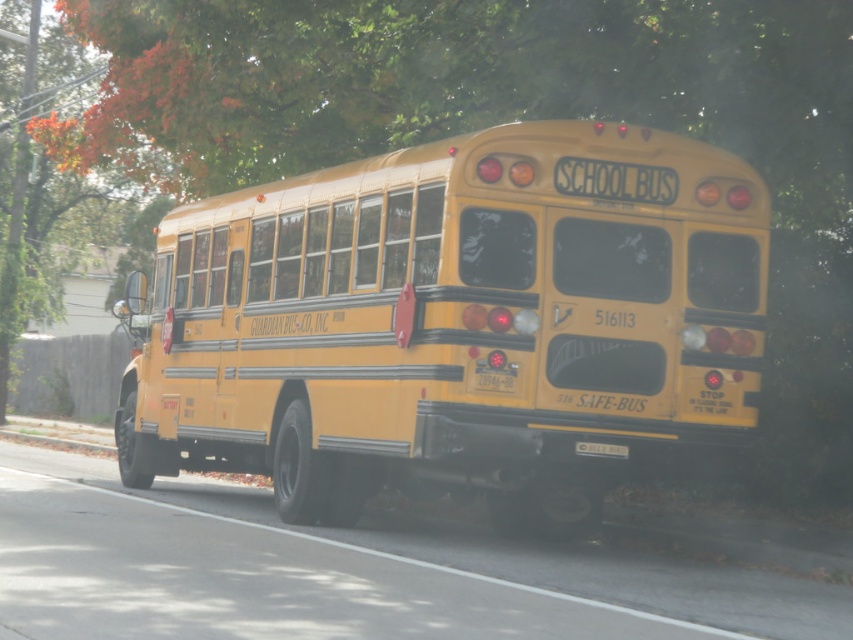
Question: Can you confirm if yellow matte/solid school bus at center is bigger than black plastic license plate at rear?

Choices:
 (A) no
 (B) yes

Answer: (B)

Question: Which point is farther to the camera?

Choices:
 (A) black plastic license plate at rear
 (B) yellow matte/solid school bus at center

Answer: (B)

Question: Can you confirm if yellow matte/solid school bus at center is bigger than black plastic license plate at rear?

Choices:
 (A) yes
 (B) no

Answer: (A)

Question: Can you confirm if yellow matte/solid school bus at center is positioned below black plastic license plate at rear?

Choices:
 (A) yes
 (B) no

Answer: (A)